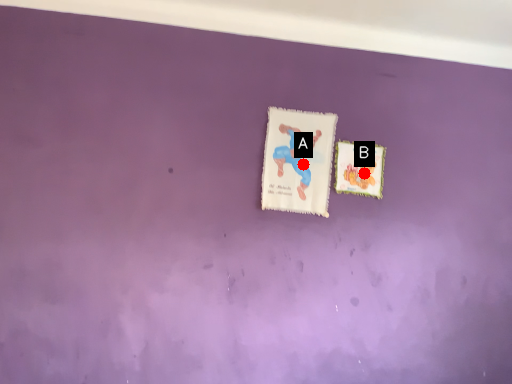
Question: Two points are circled on the image, labeled by A and B beside each circle. Which point appears closest to the camera in this image?

Choices:
 (A) A is closer
 (B) B is closer

Answer: (A)